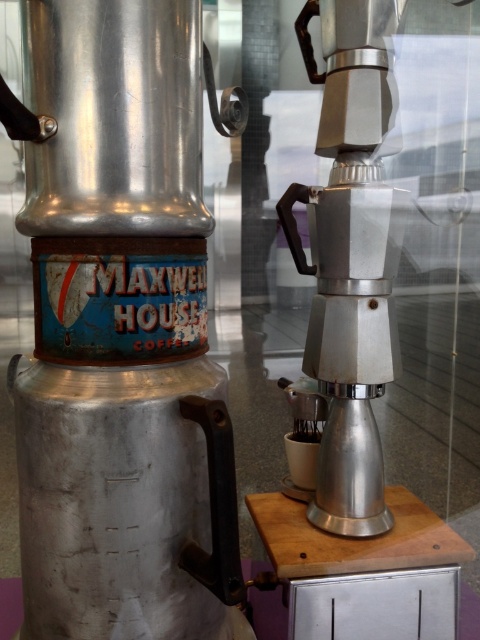
Question: Is shiny metallic coffee maker at center wider than satin silver coffee machine at center?

Choices:
 (A) no
 (B) yes

Answer: (B)

Question: Is shiny metallic coffee maker at center thinner than satin silver coffee machine at center?

Choices:
 (A) no
 (B) yes

Answer: (A)

Question: Which point is closer to the camera?

Choices:
 (A) (319, 378)
 (B) (199, 552)

Answer: (B)

Question: Does shiny metallic coffee maker at center appear under satin silver coffee machine at center?

Choices:
 (A) no
 (B) yes

Answer: (B)